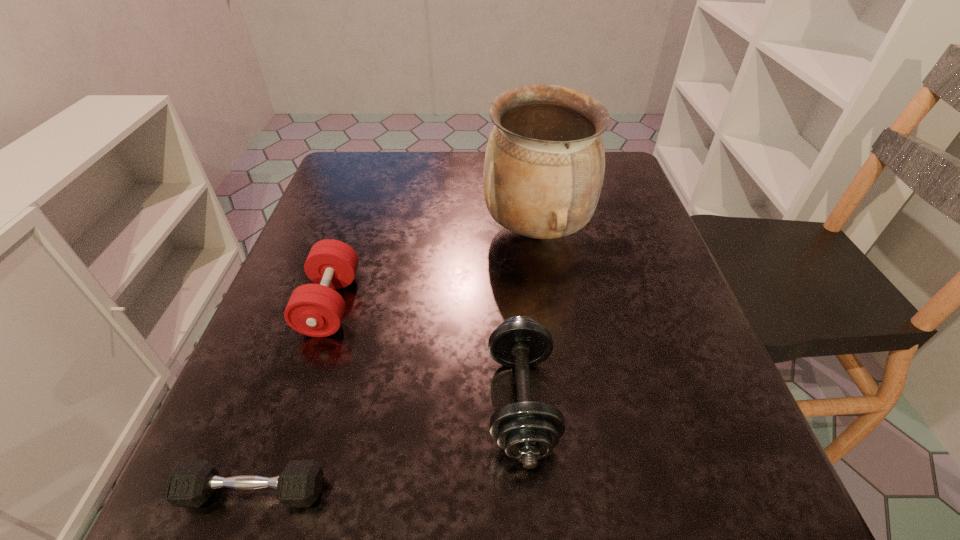
You are a GUI agent. You are given a task and a screenshot of the screen. Output one action in this format:
    pyautogui.click(x=<x>, y=<y>)
    Task: Click on the vacant space at the far edge
    The height and width of the screenshot is (540, 960).
    Given the screenshot: What is the action you would take?
    pyautogui.click(x=397, y=195)

Where is `vacant space at the near edge of the desktop`? Image resolution: width=960 pixels, height=540 pixels. vacant space at the near edge of the desktop is located at coordinates (497, 495).

In the image, there is a desktop. In order to click on vacant space at the left edge in this screenshot , I will do `click(363, 215)`.

The image size is (960, 540). In the image, there is a desktop. Identify the location of vacant area at the far left corner. (364, 186).

Image resolution: width=960 pixels, height=540 pixels. I want to click on free space at the near left corner of the desktop, so click(x=249, y=492).

At what (x,y) coordinates should I click in order to perform the action: click on free spot between the rightmost dumbbell and the tallest object. Please return your answer as a coordinate pair (x, y). This screenshot has height=540, width=960. Looking at the image, I should click on (529, 316).

Where is `empty space between the rightmost dumbbell and the tallest object`? empty space between the rightmost dumbbell and the tallest object is located at coordinates (529, 316).

At what (x,y) coordinates should I click in order to perform the action: click on vacant area that lies between the tallest object and the rightmost dumbbell. Please return your answer as a coordinate pair (x, y). The image size is (960, 540). Looking at the image, I should click on (529, 316).

The width and height of the screenshot is (960, 540). What are the coordinates of `blank region between the rightmost dumbbell and the shortest dumbbell` in the screenshot? It's located at (387, 446).

You are a GUI agent. You are given a task and a screenshot of the screen. Output one action in this format:
    pyautogui.click(x=<x>, y=<y>)
    Task: Click on the free space that is in between the urn and the shortest object
    The image size is (960, 540).
    Given the screenshot: What is the action you would take?
    pyautogui.click(x=395, y=361)